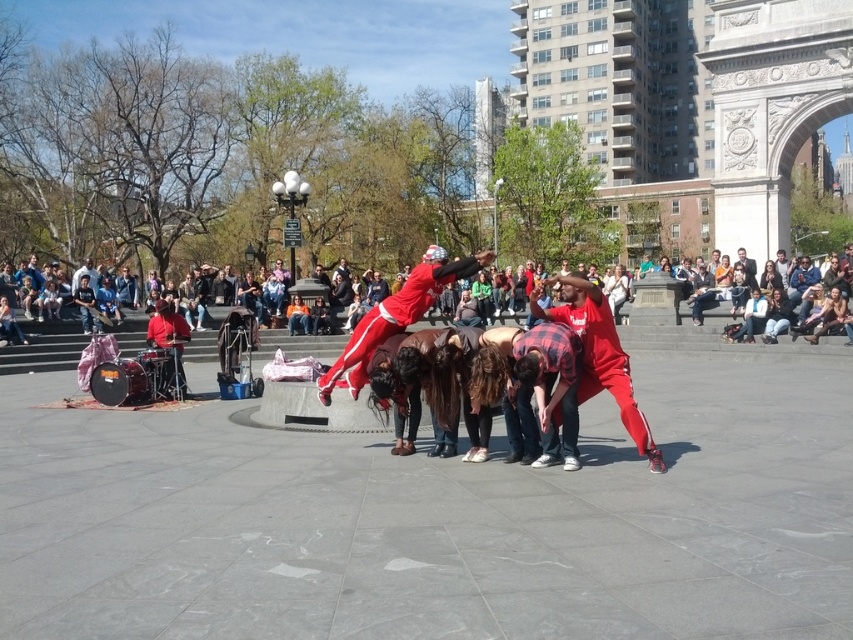
Between red plaid shirt at center and matte red pants at center, which one has more height?

With more height is red plaid shirt at center.

From the picture: Is red plaid shirt at center shorter than matte red pants at center?

In fact, red plaid shirt at center may be taller than matte red pants at center.

Image resolution: width=853 pixels, height=640 pixels. Identify the location of red plaid shirt at center. (598, 353).

Describe the element at coordinates (665, 321) in the screenshot. The image size is (853, 640). I see `matte red clothing at center` at that location.

Between matte red clothing at center and matte red pants at center, which one appears on the right side from the viewer's perspective?

From the viewer's perspective, matte red clothing at center appears more on the right side.

Locate an element on the screen. matte red clothing at center is located at coordinates (665, 321).

Does point (646, 298) come in front of point (561, 321)?

No.

From the picture: Between matte red clothing at center and red plaid shirt at center, which one has less height?

With less height is matte red clothing at center.

Is point (663, 305) behind point (567, 292)?

Yes, it is.

Find the location of a particular element. The height and width of the screenshot is (640, 853). matte red clothing at center is located at coordinates (665, 321).